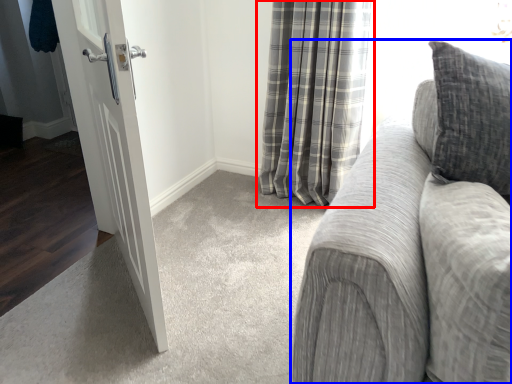
Question: Which of the following is the farthest to the observer, curtain (highlighted by a red box) or studio couch (highlighted by a blue box)?

Choices:
 (A) curtain
 (B) studio couch

Answer: (A)